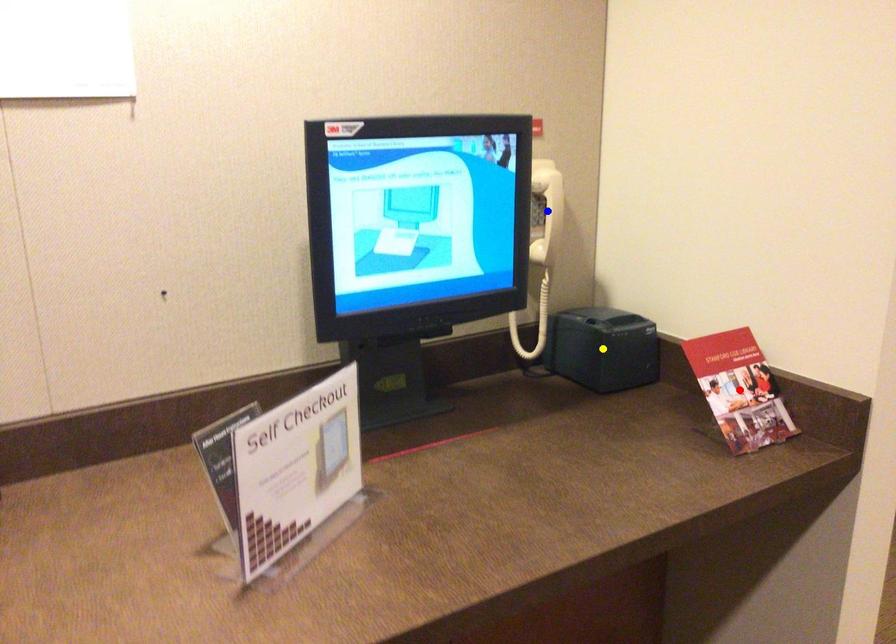
Order these from farthest to nearest:
yellow point, blue point, red point

yellow point < blue point < red point